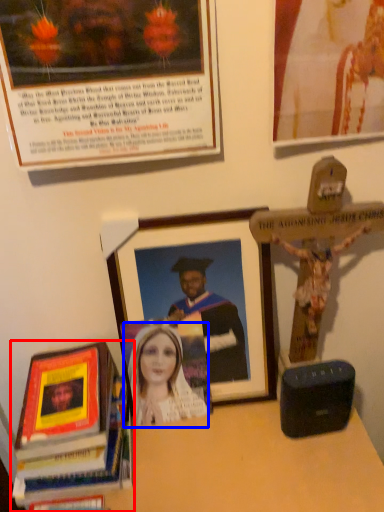
Question: Among these objects, which one is nearest to the camera, book (highlighted by a red box) or woman (highlighted by a blue box)?

Choices:
 (A) book
 (B) woman

Answer: (A)